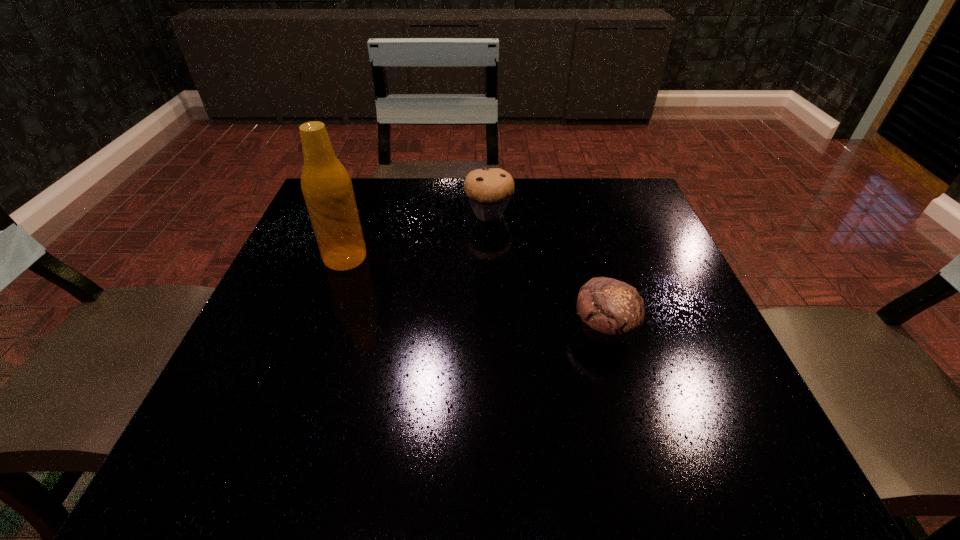
The image size is (960, 540). I want to click on object that is at the left edge, so click(x=326, y=186).

Identify the location of object situated at the right edge. Image resolution: width=960 pixels, height=540 pixels. (610, 310).

Identify the location of vacant space at the far edge of the desktop. (413, 186).

Find the location of a particular element. vacant region at the left edge of the desktop is located at coordinates (336, 319).

The width and height of the screenshot is (960, 540). Find the location of `vacant space at the right edge of the desktop`. vacant space at the right edge of the desktop is located at coordinates (648, 232).

The image size is (960, 540). Identify the location of vacant position at the far right corner of the desktop. (618, 181).

In the image, there is a desktop. In order to click on vacant space at the near right corner in this screenshot , I will do `click(692, 462)`.

The image size is (960, 540). What are the coordinates of `empty location between the nearest object and the beer bottle` in the screenshot? It's located at (475, 294).

Image resolution: width=960 pixels, height=540 pixels. What are the coordinates of `free space between the rightmost object and the second object from right to left` in the screenshot? It's located at (546, 272).

Where is `free space between the beer bottle and the farthest object`? free space between the beer bottle and the farthest object is located at coordinates (417, 235).